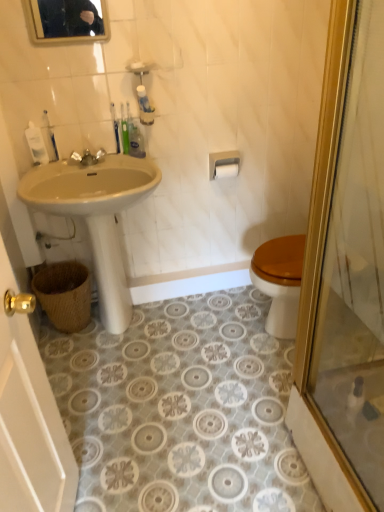
Identify the location of matte silver faucet at upper center. (88, 157).

Describe the element at coordinates (136, 142) in the screenshot. I see `green matte tube at upper center, the first toiletry when ordered from right to left` at that location.

Locate an element on the screen. The height and width of the screenshot is (512, 384). white plastic bottle at upper left, acting as the 1th toiletry starting from the left is located at coordinates (36, 144).

What do you see at coordinates (49, 137) in the screenshot? I see `white plastic toothpaste tube at upper left, which is the 2th toiletry from right to left` at bounding box center [49, 137].

The height and width of the screenshot is (512, 384). What do you see at coordinates (29, 420) in the screenshot? I see `matte white sink at left` at bounding box center [29, 420].

Find the location of a particular element. matte silver faucet at upper center is located at coordinates (88, 157).

Considering the relative sizes of white matte toilet paper at upper center and green matte tube at upper center, the 3th toiletry from the left, in the image provided, is white matte toilet paper at upper center wider than green matte tube at upper center, the 3th toiletry from the left,?

No.

Which is in front, white matte toilet paper at upper center or green matte tube at upper center, the 3th toiletry from the left?

green matte tube at upper center, the 3th toiletry from the left, is more forward.

Who is shorter, white matte toilet paper at upper center or green matte tube at upper center, the 3th toiletry from the left?

Standing shorter between the two is white matte toilet paper at upper center.

Is point (225, 170) more distant than point (136, 133)?

Yes, it is.

In the scene shown: From the image's perspective, relative to beige ceramic sink at left, is green matte tube at upper center, the 3th toiletry from the left, above or below?

Clearly, from the image's perspective, green matte tube at upper center, the 3th toiletry from the left, is above beige ceramic sink at left.

Is beige ceramic sink at left located within green matte tube at upper center, the 3th toiletry from the left?

No, beige ceramic sink at left is located outside of green matte tube at upper center, the 3th toiletry from the left.

From a real-world perspective, relative to beige ceramic sink at left, is green matte tube at upper center, the 3th toiletry from the left, vertically above or below?

In terms of real-world spatial position, green matte tube at upper center, the 3th toiletry from the left, is above beige ceramic sink at left.

From a real-world perspective, which is physically below, matte white sink at left or translucent plastic soap at upper center?

matte white sink at left, from a real-world perspective.

Is matte white sink at left in contact with translucent plastic soap at upper center?

No.

The image size is (384, 512). I want to click on soap that appears behind the matte white sink at left, so click(137, 67).

Is point (78, 30) positioned after point (131, 314)?

No, it is not.

Does gold-framed mirror at upper center have a lesser width compared to beige ceramic sink at left?

Yes, gold-framed mirror at upper center is thinner than beige ceramic sink at left.

Is gold-framed mirror at upper center oriented towards beige ceramic sink at left?

No, gold-framed mirror at upper center is not aimed at beige ceramic sink at left.

Which is more to the left, gold-framed mirror at upper center or beige ceramic sink at left?

From the viewer's perspective, gold-framed mirror at upper center appears more on the left side.

Considering the positions of objects matte white sink at left and white plastic bottle at upper left, the third toiletry when ordered from right to left, in the image provided, who is behind, matte white sink at left or white plastic bottle at upper left, the third toiletry when ordered from right to left,?

white plastic bottle at upper left, the third toiletry when ordered from right to left, is behind.

Between point (17, 475) and point (40, 136), which one is positioned behind?

The point (40, 136) is farther from the camera.

Considering the sizes of matte white sink at left and white plastic bottle at upper left, acting as the 1th toiletry starting from the left, in the image, is matte white sink at left taller or shorter than white plastic bottle at upper left, acting as the 1th toiletry starting from the left,?

Considering their sizes, matte white sink at left has more height than white plastic bottle at upper left, acting as the 1th toiletry starting from the left.

Does matte white sink at left have a larger size compared to white plastic bottle at upper left, acting as the 1th toiletry starting from the left?

Yes.

From the image's perspective, which is above, white plastic toothpaste tube at upper left, which is the 2th toiletry from right to left, or gold-framed mirror at upper center?

gold-framed mirror at upper center, from the image's perspective.

Which of these two, white plastic toothpaste tube at upper left, which is the 2th toiletry from right to left, or gold-framed mirror at upper center, is thinner?

gold-framed mirror at upper center.

Is white plastic toothpaste tube at upper left, which appears as the 2th toiletry when viewed from the left, to the left or to the right of gold-framed mirror at upper center in the image?

white plastic toothpaste tube at upper left, which appears as the 2th toiletry when viewed from the left, is positioned on gold-framed mirror at upper center's left side.

Are beige ceramic sink at left and translucent plastic soap at upper center beside each other?

They are not placed beside each other.

From the image's perspective, would you say beige ceramic sink at left is shown under translucent plastic soap at upper center?

Yes, from the image's perspective, beige ceramic sink at left is beneath translucent plastic soap at upper center.

Consider the image. How many degrees apart are the facing directions of beige ceramic sink at left and translucent plastic soap at upper center?

0.587 degrees.

You are a GUI agent. You are given a task and a screenshot of the screen. Output one action in this format:
    pyautogui.click(x=<x>, y=<y>)
    Task: Click on the toilet paper on the right side of green matte tube at upper center, the 3th toiletry from the left
    This screenshot has height=512, width=384.
    Given the screenshot: What is the action you would take?
    pyautogui.click(x=226, y=170)

Identify the location of sink in front of the green matte tube at upper center, the 3th toiletry from the left. The image size is (384, 512). (96, 216).

Which object lies nearer to the anchor point beige ceramic sink at left, green matte tube at upper center, the 3th toiletry from the left, or woven brown basket at lower left?

woven brown basket at lower left is closer to beige ceramic sink at left.

Considering their positions, is beige ceramic sink at left positioned closer to gold-framed mirror at upper center than matte white sink at left?

Based on the image, beige ceramic sink at left appears to be nearer to gold-framed mirror at upper center.

Estimate the real-world distances between objects in this image. Which object is further from white plastic toothpaste tube at upper left, which appears as the 2th toiletry when viewed from the left, translucent plastic soap at upper center or gold-framed mirror at upper center?

translucent plastic soap at upper center.

Based on their spatial positions, is translucent plastic soap at upper center or white matte toilet paper at upper center further from woven brown basket at lower left?

Among the two, translucent plastic soap at upper center is located further to woven brown basket at lower left.

Estimate the real-world distances between objects in this image. Which object is closer to white plastic toothpaste tube at upper left, which is the 2th toiletry from right to left, matte white sink at left or white matte toilet paper at upper center?

The object closer to white plastic toothpaste tube at upper left, which is the 2th toiletry from right to left, is white matte toilet paper at upper center.

Consider the image. Considering their positions, is white plastic toothpaste tube at upper left, which is the 2th toiletry from right to left, positioned closer to gold-framed mirror at upper center than translucent plastic soap at upper center?

translucent plastic soap at upper center lies closer to gold-framed mirror at upper center than the other object.

Which object lies nearer to the anchor point white matte toilet paper at upper center, translucent plastic soap at upper center or matte silver faucet at upper center?

The object closer to white matte toilet paper at upper center is translucent plastic soap at upper center.

Looking at the image, which one is located further to matte white sink at left, woven brown basket at lower left or gold-framed mirror at upper center?

gold-framed mirror at upper center lies further to matte white sink at left than the other object.

Locate an element on the screen. The height and width of the screenshot is (512, 384). tap between gold-framed mirror at upper center and matte white sink at left in the up-down direction is located at coordinates (88, 157).

Identify the location of toiletry situated between matte silver faucet at upper center and white matte toilet paper at upper center from left to right. (136, 142).

The height and width of the screenshot is (512, 384). In order to click on soap between gold-framed mirror at upper center and green matte tube at upper center, the 3th toiletry from the left, vertically in this screenshot , I will do `click(137, 67)`.

The width and height of the screenshot is (384, 512). Find the location of `soap between gold-framed mirror at upper center and beige ceramic sink at left in the up-down direction`. soap between gold-framed mirror at upper center and beige ceramic sink at left in the up-down direction is located at coordinates (137, 67).